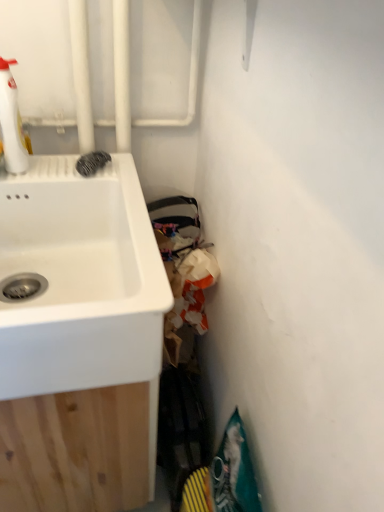
Question: Is white glossy spray bottle at upper left in front of or behind white matte sink at left in the image?

Choices:
 (A) front
 (B) behind

Answer: (B)

Question: Considering the relative positions of white glossy spray bottle at upper left and white matte sink at left in the image provided, is white glossy spray bottle at upper left to the left or to the right of white matte sink at left?

Choices:
 (A) right
 (B) left

Answer: (B)

Question: Do you think white glossy spray bottle at upper left is within white matte sink at left, or outside of it?

Choices:
 (A) inside
 (B) outside

Answer: (B)

Question: From the image's perspective, is white matte sink at left located above or below white glossy spray bottle at upper left?

Choices:
 (A) above
 (B) below

Answer: (B)

Question: Which is correct: white matte sink at left is inside white glossy spray bottle at upper left, or outside of it?

Choices:
 (A) inside
 (B) outside

Answer: (B)

Question: In the image, is white matte sink at left on the left side or the right side of white glossy spray bottle at upper left?

Choices:
 (A) right
 (B) left

Answer: (A)

Question: From a real-world perspective, is white matte sink at left positioned above or below white glossy spray bottle at upper left?

Choices:
 (A) below
 (B) above

Answer: (A)